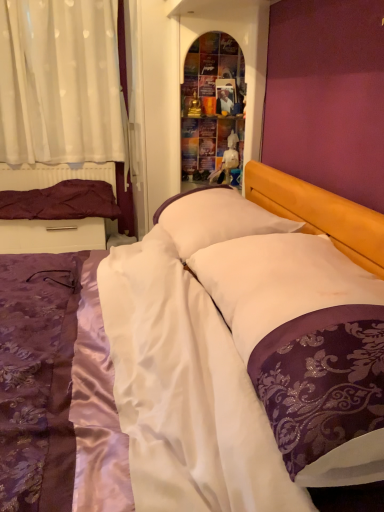
You are a GUI agent. You are given a task and a screenshot of the screen. Output one action in this format:
    pyautogui.click(x=<x>, y=<y>)
    Task: Click on the white sheer curtain at upper left
    Image resolution: width=384 pixels, height=512 pixels.
    Given the screenshot: What is the action you would take?
    pyautogui.click(x=60, y=82)

Measure the distance between point (2, 473) and camera.

The distance of point (2, 473) from camera is 27.36 inches.

What do you see at coordinates (213, 108) in the screenshot? I see `multicolored glass shelf at center` at bounding box center [213, 108].

Where is `white satin pillow at center, the 1th pillow in the right-to-left sequence`? white satin pillow at center, the 1th pillow in the right-to-left sequence is located at coordinates (278, 281).

I want to click on white sheer curtain at upper left, so click(60, 82).

How different are the orientations of white sheer curtain at upper left and multicolored glass shelf at center in degrees?

The facing directions of white sheer curtain at upper left and multicolored glass shelf at center are 86.5 degrees apart.

From a real-world perspective, is white sheer curtain at upper left physically located above or below multicolored glass shelf at center?

From a real-world perspective, white sheer curtain at upper left is physically above multicolored glass shelf at center.

Consider the image. Which object is wider, white sheer curtain at upper left or multicolored glass shelf at center?

multicolored glass shelf at center is wider.

Is multicolored glass shelf at center located within white sheer curtain at upper left?

That's incorrect, multicolored glass shelf at center is not inside white sheer curtain at upper left.

Based on their positions, is white satin pillow at center, the 1th pillow in the right-to-left sequence, located to the left or right of purple satin pillow at left, which is counted as the 3th pillow, starting from the front?

From the image, it's evident that white satin pillow at center, the 1th pillow in the right-to-left sequence, is to the right of purple satin pillow at left, which is counted as the 3th pillow, starting from the front.

Based on the photo, measure the distance between white satin pillow at center, the 1th pillow in the right-to-left sequence, and purple satin pillow at left, which is the 1th pillow in left-to-right order.

white satin pillow at center, the 1th pillow in the right-to-left sequence, is 2.07 meters from purple satin pillow at left, which is the 1th pillow in left-to-right order.

Can purple satin pillow at left, which appears as the third pillow when viewed from the right, be found inside white satin pillow at center, the first pillow from the front?

Definitely not — purple satin pillow at left, which appears as the third pillow when viewed from the right, is not inside white satin pillow at center, the first pillow from the front.

Considering the positions of objects white satin pillow at center, which is the 3th pillow in back-to-front order, and purple satin pillow at left, which is the 1th pillow in left-to-right order, in the image provided, who is behind, white satin pillow at center, which is the 3th pillow in back-to-front order, or purple satin pillow at left, which is the 1th pillow in left-to-right order,?

purple satin pillow at left, which is the 1th pillow in left-to-right order, is further away from the camera.

Looking at this image, considering the relative sizes of purple satin bed at center and white soft pillow at center, arranged as the 2th pillow when viewed from the right, in the image provided, is purple satin bed at center taller than white soft pillow at center, arranged as the 2th pillow when viewed from the right,?

Yes.

Which is more to the right, purple satin bed at center or white soft pillow at center, positioned as the second pillow in left-to-right order?

Positioned to the right is white soft pillow at center, positioned as the second pillow in left-to-right order.

Is purple satin bed at center touching white soft pillow at center, acting as the 2th pillow starting from the front?

purple satin bed at center and white soft pillow at center, acting as the 2th pillow starting from the front, are clearly separated.

Where is `bed in front of the white soft pillow at center, positioned as the second pillow in left-to-right order`? bed in front of the white soft pillow at center, positioned as the second pillow in left-to-right order is located at coordinates (51, 396).

Does purple satin bed at center have a greater width compared to multicolored glass shelf at center?

Correct, the width of purple satin bed at center exceeds that of multicolored glass shelf at center.

Is purple satin bed at center completely or partially outside of multicolored glass shelf at center?

Yes.

How many degrees apart are the facing directions of purple satin bed at center and multicolored glass shelf at center?

1.82 degrees.

From a real-world perspective, who is located lower, purple satin bed at center or multicolored glass shelf at center?

In real-world perspective, purple satin bed at center is lower.

From a real-world perspective, is purple satin pillow at left, which is counted as the 3th pillow, starting from the front, below purple satin bed at center?

Incorrect, from a real-world perspective, purple satin pillow at left, which is counted as the 3th pillow, starting from the front, is higher than purple satin bed at center.

Would you consider purple satin pillow at left, which appears as the third pillow when viewed from the right, to be distant from purple satin bed at center?

Yes, purple satin pillow at left, which appears as the third pillow when viewed from the right, is far from purple satin bed at center.

Which is behind, purple satin pillow at left, which is counted as the 3th pillow, starting from the front, or purple satin bed at center?

Positioned behind is purple satin pillow at left, which is counted as the 3th pillow, starting from the front.

Is purple satin pillow at left, positioned as the 1th pillow in back-to-front order, next to multicolored glass shelf at center and touching it?

They are not placed beside each other.

Is purple satin pillow at left, which is counted as the 3th pillow, starting from the front, not within multicolored glass shelf at center?

That's correct, purple satin pillow at left, which is counted as the 3th pillow, starting from the front, is outside of multicolored glass shelf at center.

You are a GUI agent. You are given a task and a screenshot of the screen. Output one action in this format:
    pyautogui.click(x=<x>, y=<y>)
    Task: Click on the 2nd pillow counting from the left side of the multicolored glass shelf at center
    This screenshot has width=384, height=512.
    Given the screenshot: What is the action you would take?
    pyautogui.click(x=61, y=202)

Is purple satin pillow at left, which is the 1th pillow in left-to-right order, to the right of multicolored glass shelf at center from the viewer's perspective?

No.

Can you see white sheer curtain at upper left touching purple satin bed at center?

white sheer curtain at upper left is not next to purple satin bed at center, and they're not touching.

In the scene shown: Can you confirm if white sheer curtain at upper left is smaller than purple satin bed at center?

Indeed, white sheer curtain at upper left has a smaller size compared to purple satin bed at center.

Does point (46, 75) lie behind point (303, 193)?

Yes, it is.

Does white sheer curtain at upper left have a greater width compared to purple satin bed at center?

Result: In fact, white sheer curtain at upper left might be narrower than purple satin bed at center.

Locate an element on the screen. This screenshot has height=512, width=384. shelf below the white sheer curtain at upper left (from the image's perspective) is located at coordinates pyautogui.click(x=213, y=108).

From the white satin pillow at center, which appears as the third pillow when viewed from the left, count the 2nd pillow to the left and point to it. Please provide its 2D coordinates.

[(61, 202)]

Based on their spatial positions, is purple satin pillow at left, which is counted as the 3th pillow, starting from the front, or purple satin bed at center closer to white sheer curtain at upper left?

Based on the image, purple satin pillow at left, which is counted as the 3th pillow, starting from the front, appears to be nearer to white sheer curtain at upper left.

Which object lies nearer to the anchor point white satin pillow at center, which appears as the third pillow when viewed from the left, white soft pillow at center, arranged as the 2th pillow when viewed from the right, or multicolored glass shelf at center?

white soft pillow at center, arranged as the 2th pillow when viewed from the right, is closer to white satin pillow at center, which appears as the third pillow when viewed from the left.

Estimate the real-world distances between objects in this image. Which object is further from white soft pillow at center, positioned as the second pillow in left-to-right order, purple satin bed at center or purple satin pillow at left, which is counted as the 3th pillow, starting from the front?

Among the two, purple satin pillow at left, which is counted as the 3th pillow, starting from the front, is located further to white soft pillow at center, positioned as the second pillow in left-to-right order.

Based on their spatial positions, is multicolored glass shelf at center or purple satin bed at center closer to white sheer curtain at upper left?

multicolored glass shelf at center lies closer to white sheer curtain at upper left than the other object.

From the image, which object appears to be nearer to multicolored glass shelf at center, white sheer curtain at upper left or purple satin bed at center?

purple satin bed at center.

From the image, which object appears to be farther from purple satin bed at center, white satin pillow at center, which is the 3th pillow in back-to-front order, or white soft pillow at center, arranged as the 2th pillow when viewed from the right?

Based on the image, white soft pillow at center, arranged as the 2th pillow when viewed from the right, appears to be further to purple satin bed at center.

Based on the photo, considering their positions, is white satin pillow at center, the first pillow from the front, positioned closer to multicolored glass shelf at center than purple satin pillow at left, which is the 1th pillow in left-to-right order?

purple satin pillow at left, which is the 1th pillow in left-to-right order, is closer to multicolored glass shelf at center.

Estimate the real-world distances between objects in this image. Which object is closer to white soft pillow at center, acting as the 2th pillow starting from the front, white satin pillow at center, the 1th pillow in the right-to-left sequence, or purple satin pillow at left, positioned as the 1th pillow in back-to-front order?

Among the two, white satin pillow at center, the 1th pillow in the right-to-left sequence, is located nearer to white soft pillow at center, acting as the 2th pillow starting from the front.

The height and width of the screenshot is (512, 384). What are the coordinates of `pillow located between white satin pillow at center, the first pillow from the front, and multicolored glass shelf at center in the depth direction` in the screenshot? It's located at (215, 218).

I want to click on shelf located between white satin pillow at center, which appears as the third pillow when viewed from the left, and white sheer curtain at upper left in the depth direction, so click(213, 108).

What are the coordinates of `pillow between white satin pillow at center, the first pillow from the front, and purple satin pillow at left, which appears as the third pillow when viewed from the right, along the z-axis` in the screenshot? It's located at (215, 218).

Where is `curtain between purple satin bed at center and purple satin pillow at left, positioned as the 1th pillow in back-to-front order, in the front-back direction`? The image size is (384, 512). curtain between purple satin bed at center and purple satin pillow at left, positioned as the 1th pillow in back-to-front order, in the front-back direction is located at coordinates (60, 82).